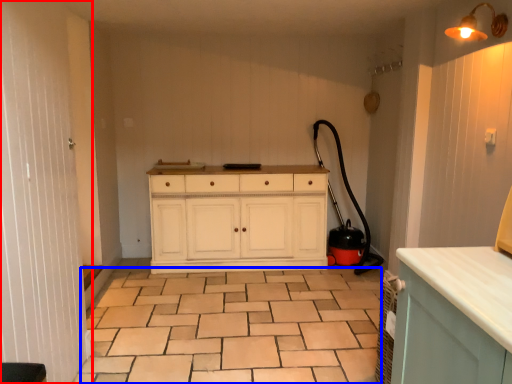
Question: Which object is closer to the camera taking this photo, screen door (highlighted by a red box) or ceramic tile (highlighted by a blue box)?

Choices:
 (A) screen door
 (B) ceramic tile

Answer: (A)